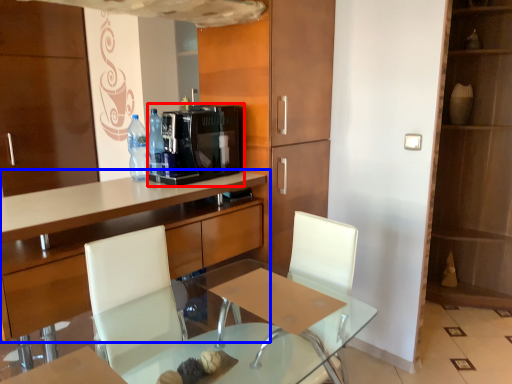
Question: Among these objects, which one is nearest to the camera, coffee machine (highlighted by a red box) or cabinetry (highlighted by a blue box)?

Choices:
 (A) coffee machine
 (B) cabinetry

Answer: (B)